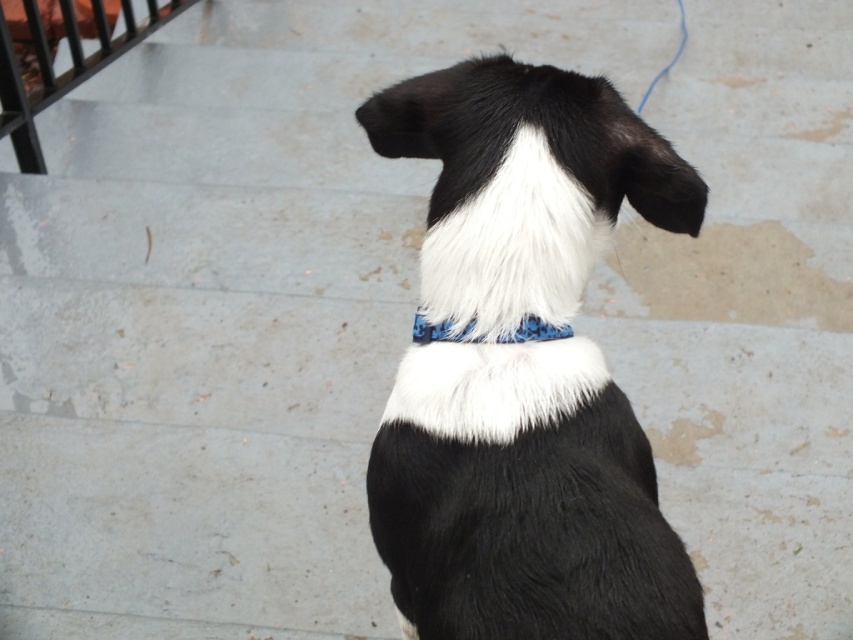
Which is in front, point (393, 545) or point (413, 328)?

Positioned in front is point (393, 545).

Looking at this image, who is taller, black/white fur at center or blue camouflage fabric at center?

black/white fur at center

At what (x,y) coordinates should I click in order to perform the action: click on black/white fur at center. Please return your answer as a coordinate pair (x, y). The width and height of the screenshot is (853, 640). Looking at the image, I should click on (523, 369).

This screenshot has height=640, width=853. In order to click on black/white fur at center in this screenshot , I will do `click(523, 369)`.